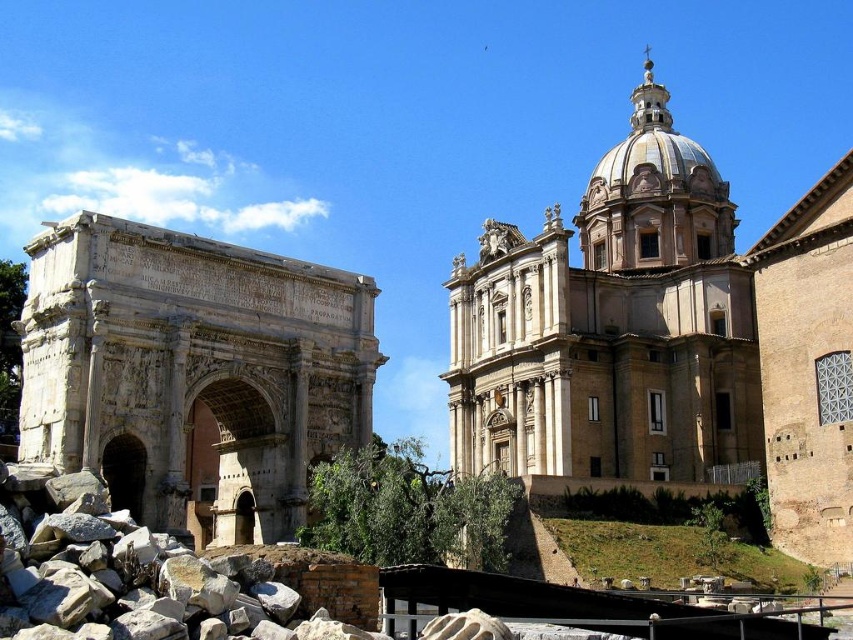
Between beige stone church at upper right and carved stone arch at left, which one appears on the left side from the viewer's perspective?

carved stone arch at left

Who is more forward, (596, 278) or (215, 320)?

Positioned in front is point (215, 320).

The width and height of the screenshot is (853, 640). What are the coordinates of `beige stone church at upper right` in the screenshot? It's located at (665, 339).